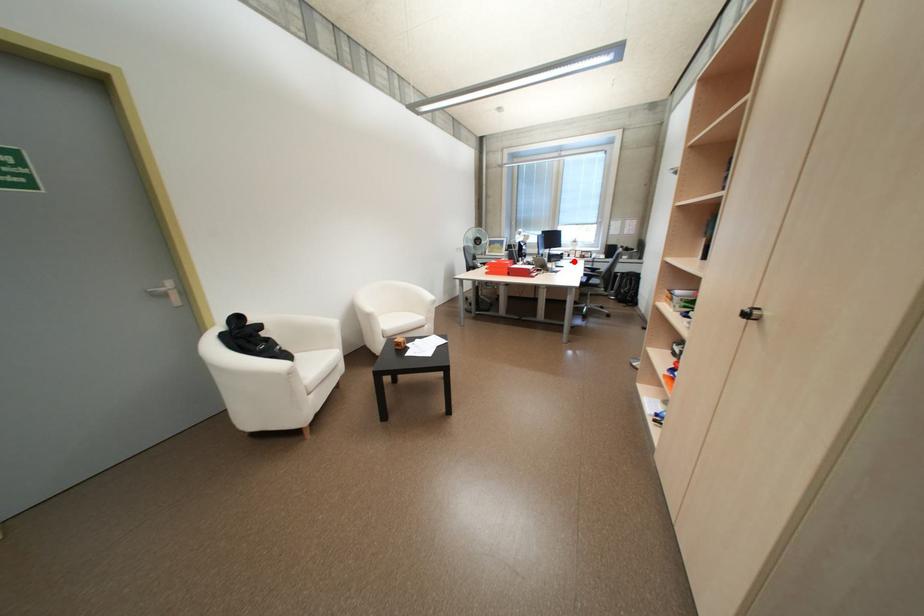
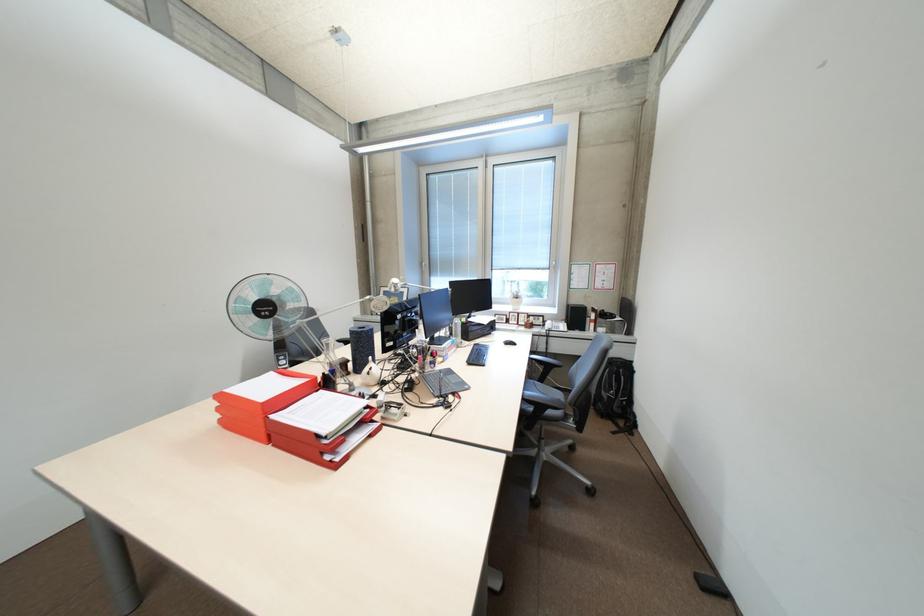
In the second image, find the point that corresponds to the highlighted location in the first image.

(504, 341)